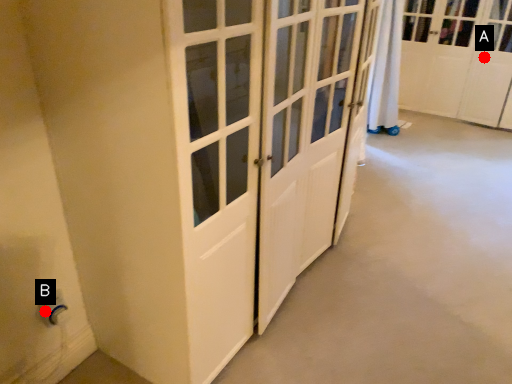
Question: Two points are circled on the image, labeled by A and B beside each circle. Which point is farther from the camera taking this photo?

Choices:
 (A) A is further
 (B) B is further

Answer: (A)